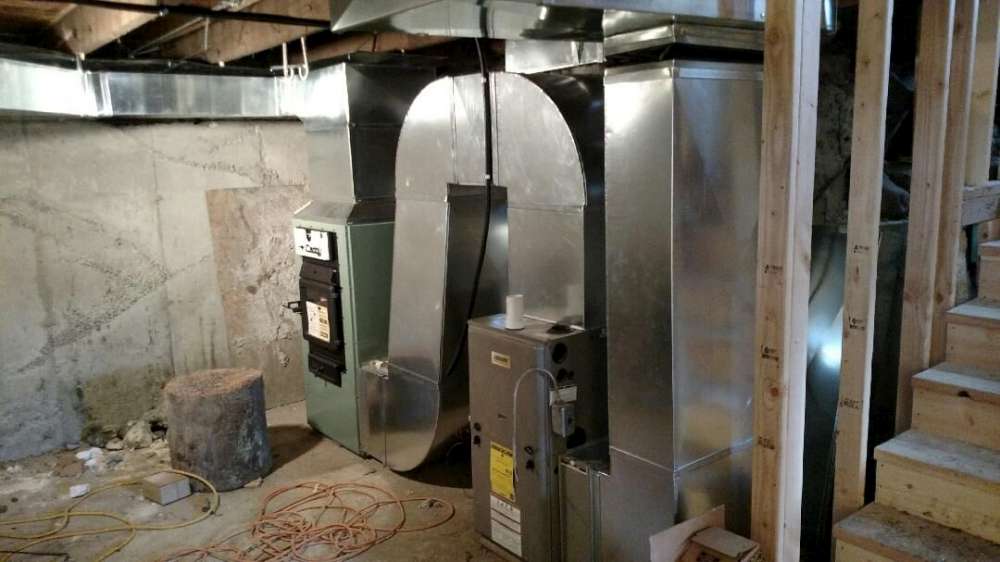
Identify the location of light. The width and height of the screenshot is (1000, 562). (831, 370).